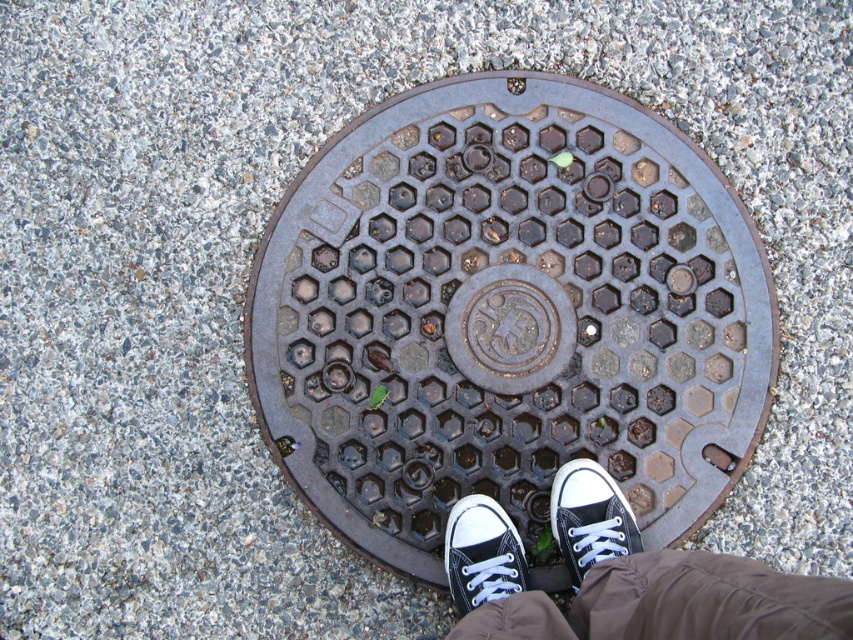
Question: Estimate the real-world distances between objects in this image. Which object is closer to the black canvas shoes at center?

Choices:
 (A) rusty metal manhole cover at center
 (B) white canvas shoe at center

Answer: (B)

Question: Does black canvas shoes at center have a lesser width compared to rusty metal manhole cover at center?

Choices:
 (A) no
 (B) yes

Answer: (A)

Question: Estimate the real-world distances between objects in this image. Which object is closer to the rusty metal manhole cover at center?

Choices:
 (A) black canvas shoes at center
 (B) black canvas shoe at center
 (C) white canvas shoe at center

Answer: (B)

Question: From the image, what is the correct spatial relationship of black canvas shoe at center in relation to white canvas shoe at center?

Choices:
 (A) right
 (B) left

Answer: (A)

Question: Does black canvas shoes at center have a lesser width compared to rusty metal manhole cover at center?

Choices:
 (A) no
 (B) yes

Answer: (A)

Question: Which point is closer to the camera?

Choices:
 (A) (566, 492)
 (B) (519, 388)
 (C) (485, 545)
 (D) (519, 612)

Answer: (D)